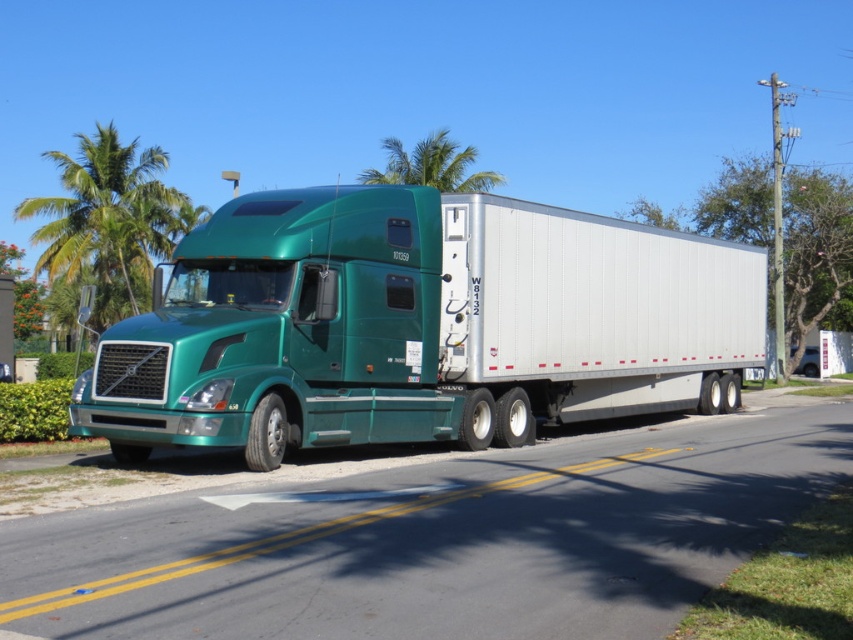
Question: Where is green metallic truck at center located in relation to green leafy palm tree at upper left in the image?

Choices:
 (A) below
 (B) above

Answer: (A)

Question: Estimate the real-world distances between objects in this image. Which object is closer to the green metallic truck at center?

Choices:
 (A) green leafy palm tree at upper center
 (B) green leafy palm tree at upper left

Answer: (A)

Question: Which point is closer to the camera taking this photo?

Choices:
 (A) (158, 330)
 (B) (138, 307)
 (C) (425, 144)

Answer: (A)

Question: Is green metallic truck at center in front of green leafy palm tree at upper center?

Choices:
 (A) no
 (B) yes

Answer: (B)

Question: Which of the following is the farthest from the observer?

Choices:
 (A) (107, 193)
 (B) (749, 310)
 (C) (440, 140)

Answer: (C)

Question: Is green metallic truck at center in front of green leafy palm tree at upper center?

Choices:
 (A) yes
 (B) no

Answer: (A)